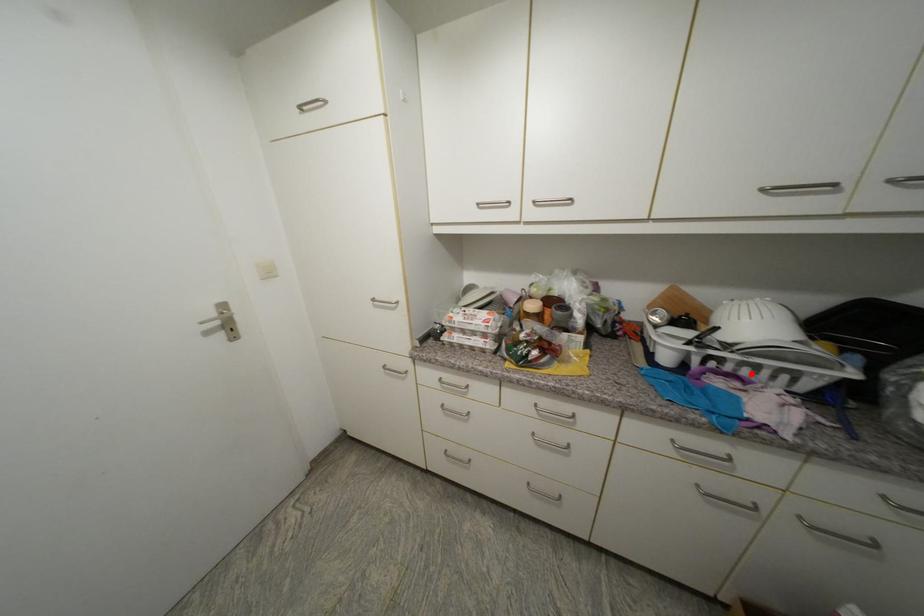
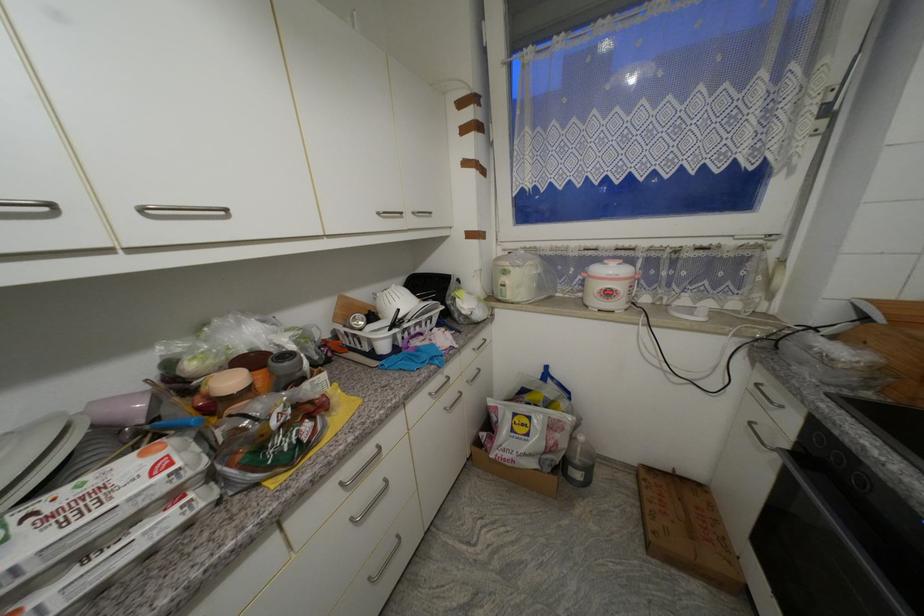
Where in the second image is the point corresponding to the highlighted location from the first image?

(423, 331)